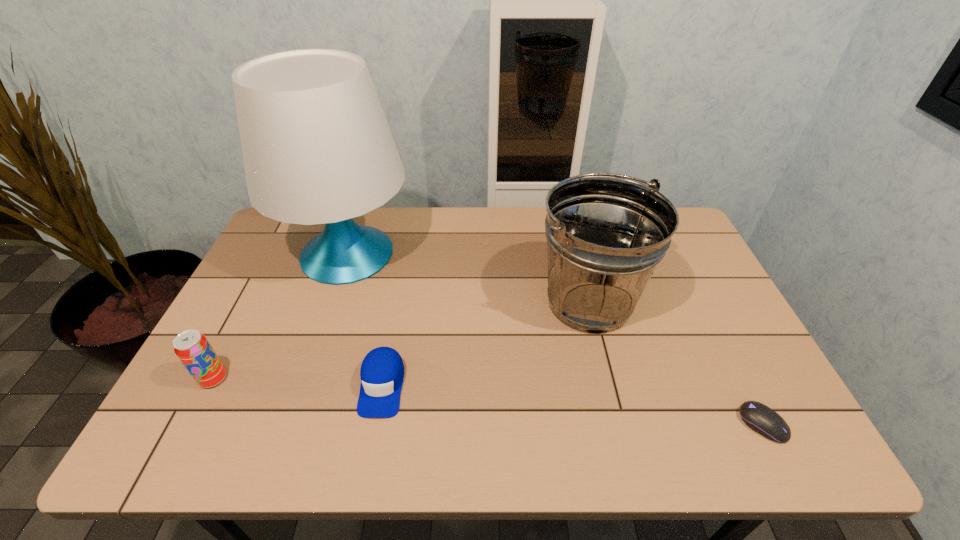
At what (x,y) coordinates should I click in order to perform the action: click on vacant space located on the front-facing side of the baseball cap. Please return your answer as a coordinate pair (x, y). Looking at the image, I should click on (371, 449).

Image resolution: width=960 pixels, height=540 pixels. Identify the location of blank space located 0.200m on the back of the computer mouse. (719, 339).

What are the coordinates of `object that is positioned at the far edge` in the screenshot? It's located at (317, 149).

Identify the location of object at the near edge. The height and width of the screenshot is (540, 960). (760, 418).

The height and width of the screenshot is (540, 960). I want to click on table lamp that is at the left edge, so click(317, 149).

Find the location of a particular element. The height and width of the screenshot is (540, 960). soda can located in the left edge section of the desktop is located at coordinates (193, 349).

Where is `object that is at the right edge`? The image size is (960, 540). object that is at the right edge is located at coordinates (760, 418).

This screenshot has width=960, height=540. I want to click on object present at the far left corner, so (317, 149).

At what (x,y) coordinates should I click in order to perform the action: click on object that is positioned at the near right corner. Please return your answer as a coordinate pair (x, y). The height and width of the screenshot is (540, 960). Looking at the image, I should click on (760, 418).

At what (x,y) coordinates should I click in order to perform the action: click on free space at the far edge of the desktop. Please return your answer as a coordinate pair (x, y). The image size is (960, 540). Looking at the image, I should click on (458, 230).